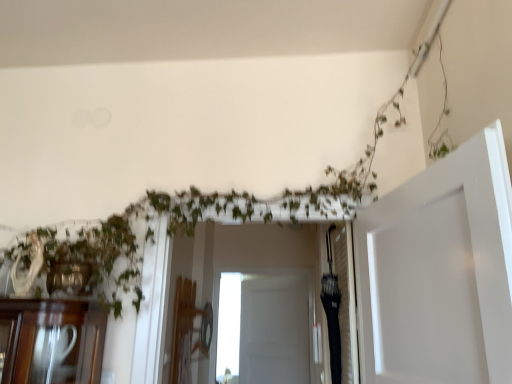
The width and height of the screenshot is (512, 384). What do you see at coordinates (274, 330) in the screenshot? I see `white glossy door at center` at bounding box center [274, 330].

This screenshot has width=512, height=384. What are the coordinates of `white glossy door at center` in the screenshot? It's located at (274, 330).

Image resolution: width=512 pixels, height=384 pixels. I want to click on white glossy door at center, so click(274, 330).